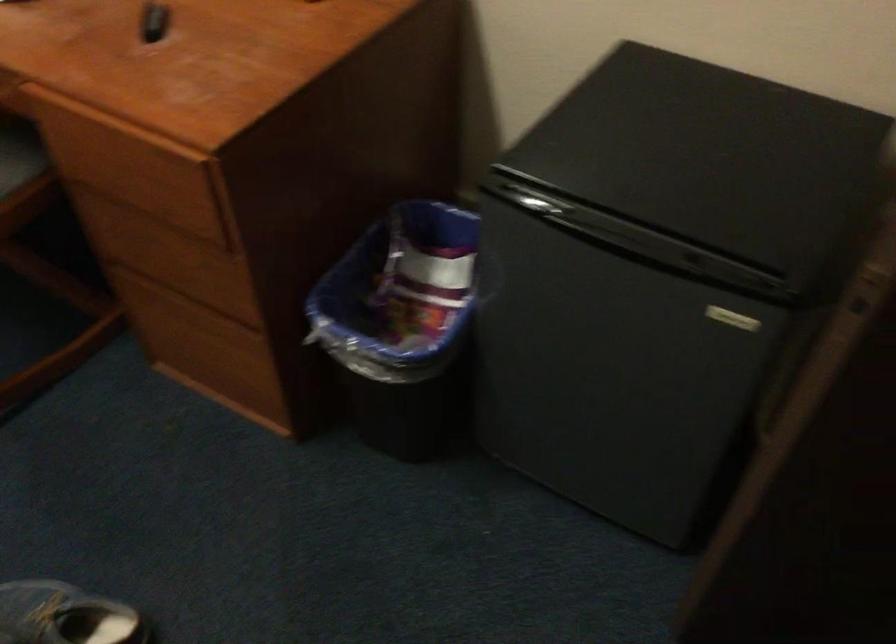
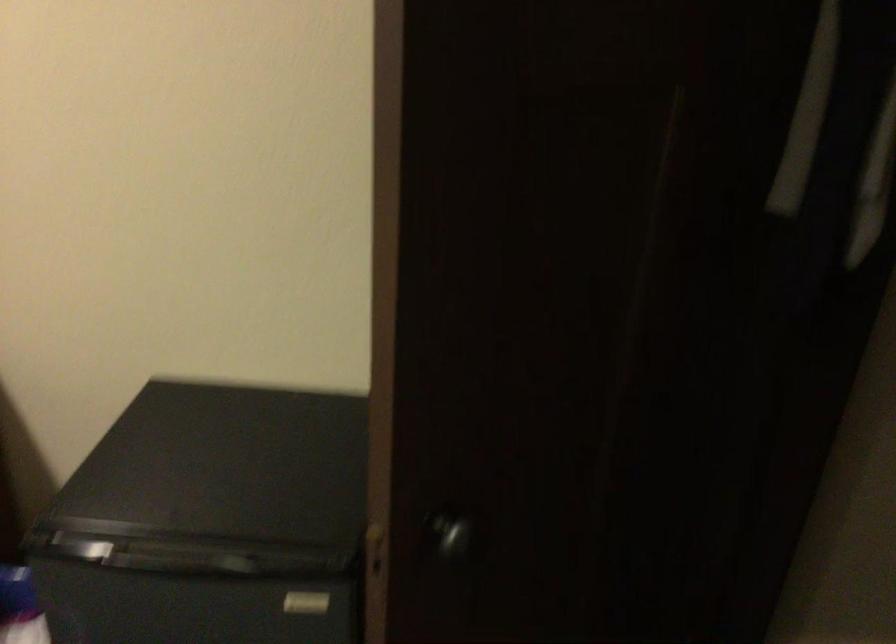
Find the pixel in the second image that matches (728,319) in the first image.

(306, 603)